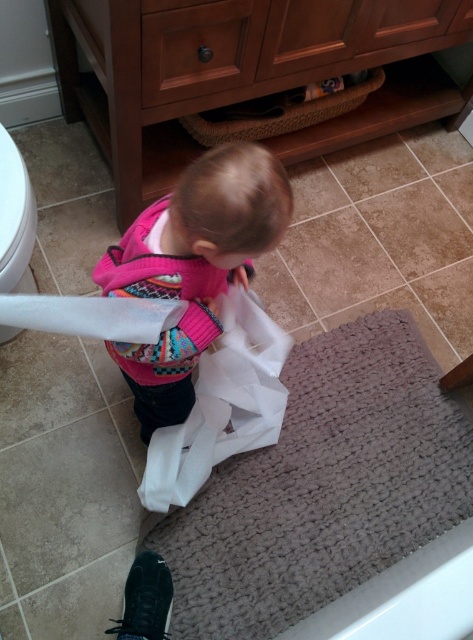
You are standing in a bathroom and see the point at coordinates (183, 179). If you want to place a 12 inch wide decorative plate there, will it fit without overlapping any existing objects?

The point at (183, 179) is 32.60 inches away from you. Since the plate is only 12 inches wide, it should fit without overlapping existing objects as there is sufficient space available.

You are a parent trying to dress your child in the bathroom. The child is wearing the pink knitted sweater at center and holding the white paper towel at lower left. Which item is taller?

The pink knitted sweater at center is taller than the white paper towel at lower left.

From the picture: The child is holding a large roll of toilet paper and wearing a pink knitted sweater at center. If the roll of toilet paper is 12 inches in diameter, can the child hold it while keeping both arms fully extended without touching the sweater?

The distance between the child holding the large roll of toilet paper and the pink knitted sweater at center is 29.67 inches. Since the roll is 12 inches in diameter, the child can hold it with both arms fully extended without touching the sweater as there is enough space between them.